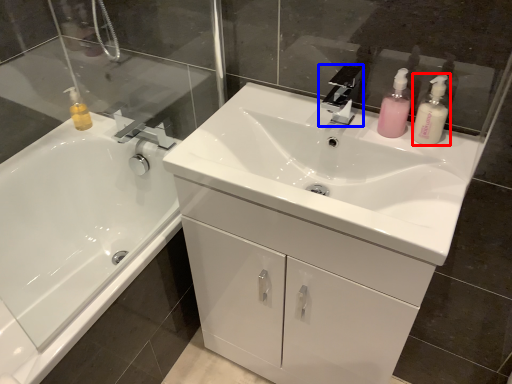
Question: Which point is further to the camera, toiletry (highlighted by a red box) or tap (highlighted by a blue box)?

Choices:
 (A) toiletry
 (B) tap

Answer: (B)